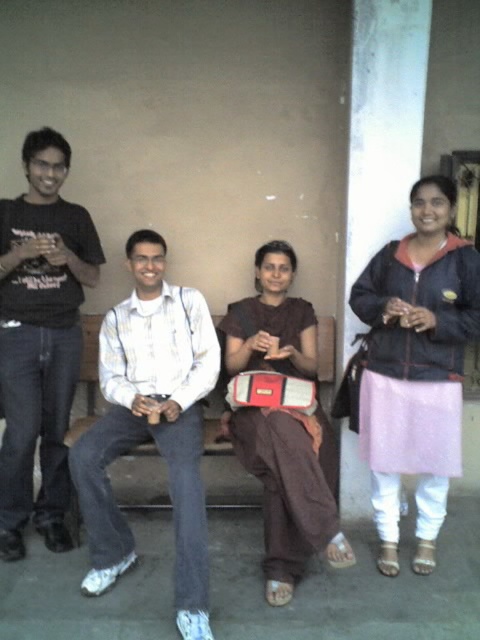
Between point (460, 294) and point (100, 554), which one is positioned behind?

The point (100, 554) is behind.

Is pink fabric skirt at right to the left of white striped shirt at center from the viewer's perspective?

In fact, pink fabric skirt at right is to the right of white striped shirt at center.

Where is `pink fabric skirt at right`? The width and height of the screenshot is (480, 640). pink fabric skirt at right is located at coordinates click(416, 365).

Where is `pink fabric skirt at right`? pink fabric skirt at right is located at coordinates (416, 365).

Does white striped shirt at center appear on the right side of black matte shirt at left?

Indeed, white striped shirt at center is positioned on the right side of black matte shirt at left.

Consider the image. Can you confirm if white striped shirt at center is positioned above black matte shirt at left?

No, white striped shirt at center is not above black matte shirt at left.

Where is `white striped shirt at center`? white striped shirt at center is located at coordinates (151, 426).

Where is `white striped shirt at center`? The image size is (480, 640). white striped shirt at center is located at coordinates (151, 426).

Is black matte shirt at left above brown fabric at center?

Correct, black matte shirt at left is located above brown fabric at center.

How much distance is there between black matte shirt at left and brown fabric at center?

black matte shirt at left is 34.94 inches from brown fabric at center.

Find the location of `black matte shirt at left`. black matte shirt at left is located at coordinates (40, 339).